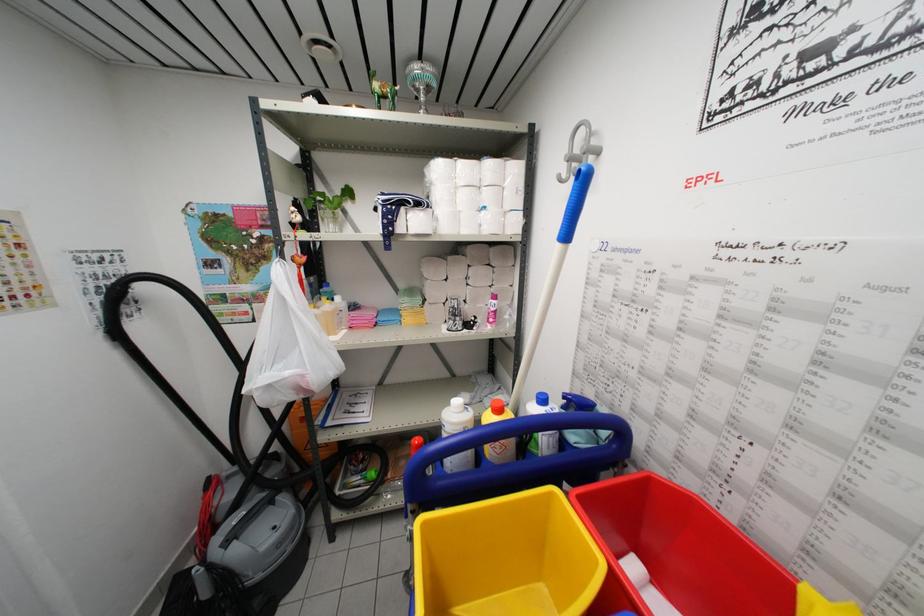
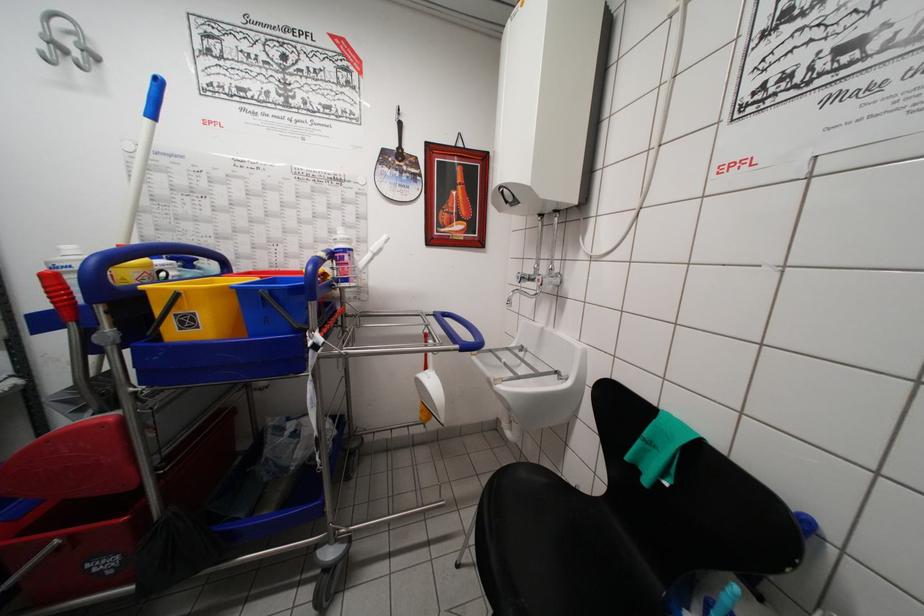
Locate, in the second image, the point that corresponds to point 623,377 in the first image.

(203, 249)